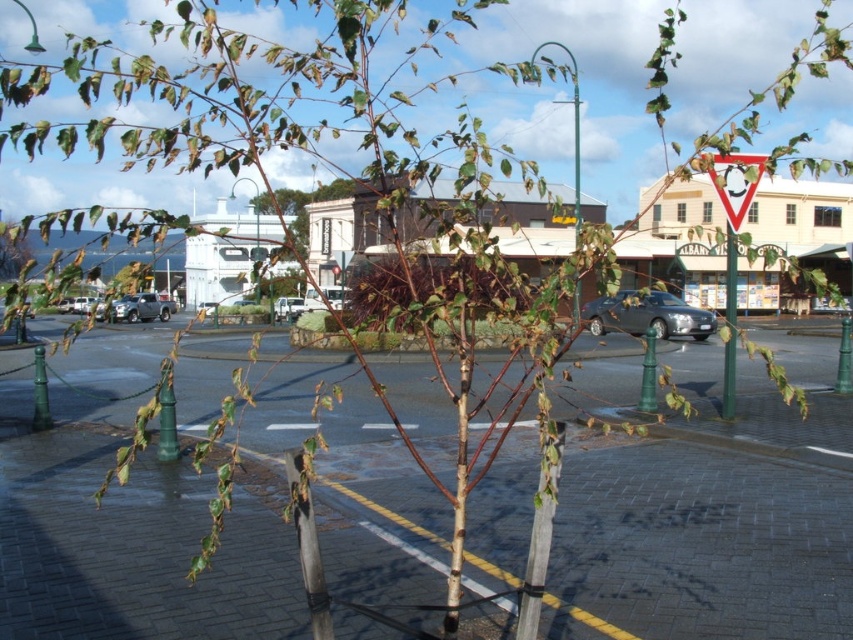
You are a delivery driver who needs to park your white matte van at center near the green matte tree at upper left. The parking spot requires vehicles to be within 15 meters of the designated tree. Will your van meet this requirement?

The green matte tree at upper left is 16.17 meters from the white matte van at center, which exceeds the 15 meters requirement. Therefore, the van is too far to meet the parking rule.

You are a pedestrian standing at the crosswalk near the green matte tree at upper left. You want to cross the street to reach the white matte van at center. Is the van visible from your current position?

Yes, the white matte van at center is visible from the pedestrian position at the crosswalk near the green matte tree at upper left because the green matte tree at upper left is in front of the van, but since it is a young tree with thin branches and sparse leaves, it might not fully obstruct the view. However, the description states the tree is supported by wooden stakes and positioned near the pedestrian area, so the van should still be visible unless the tree is directly blocking the line of sight. The